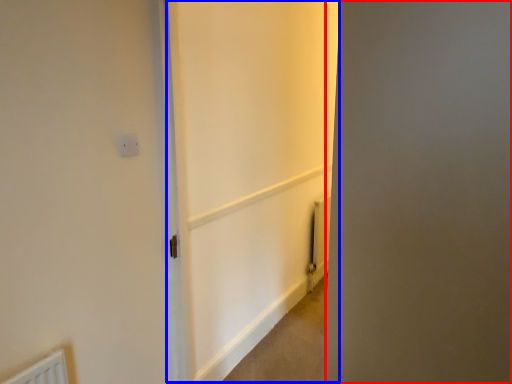
Question: Which of the following is the closest to the observer, screen door (highlighted by a red box) or screen door (highlighted by a blue box)?

Choices:
 (A) screen door
 (B) screen door

Answer: (A)